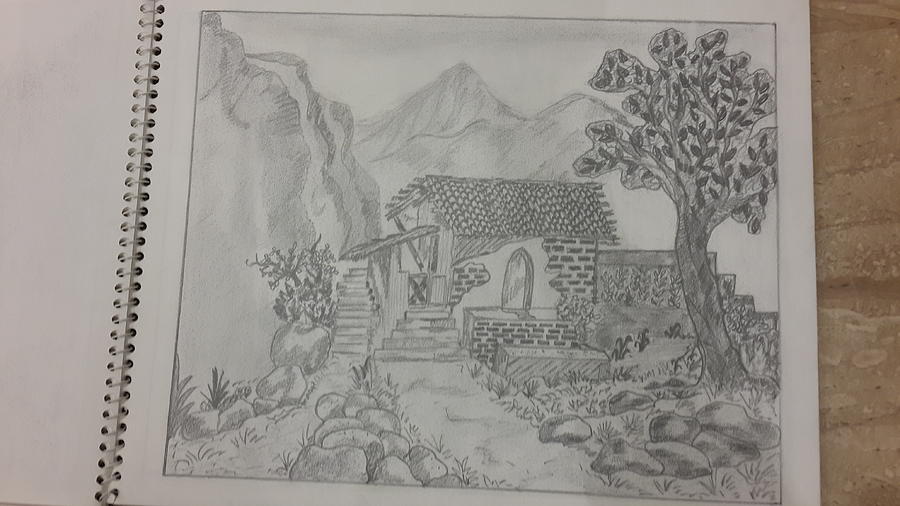
Find the location of `drawing of stairs`. drawing of stairs is located at coordinates (358, 321).